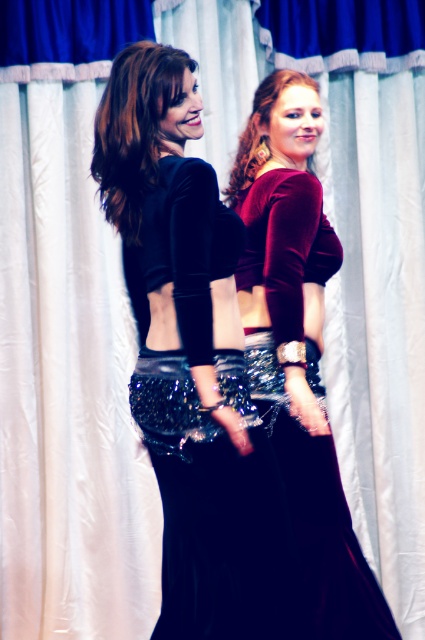
You are standing at the point labeled point (186, 552) in the image. You want to move to the nearest exit, which is located 10 feet away from your current position. Can you safely reach the exit without moving more than 10 feet?

Yes, the point labeled point (186, 552) is 8.52 feet away from the viewer, so moving 10 feet towards the exit would be sufficient to reach it safely without exceeding the distance.

You are a photographer setting up for a photoshoot. You need to position a spotlight to the right of both the velvet black dress at center and the velvet maroon crop top at center. Since both are at the center, which direction should you place the spotlight relative to their current positions?

The velvet black dress at center is to the left of the velvet maroon crop top at center, so the spotlight should be placed to the right of the velvet maroon crop top at center to ensure it is to the right of both.

You are a costume designer preparing for a performance. You have two outfits available in the scene. The velvet black dress at center and the velvet maroon crop top at center. Which outfit should you choose if you need a smaller size for the lead actress?

The velvet black dress at center has a smaller size compared to the velvet maroon crop top at center, so you should choose the velvet black dress at center for the lead actress.